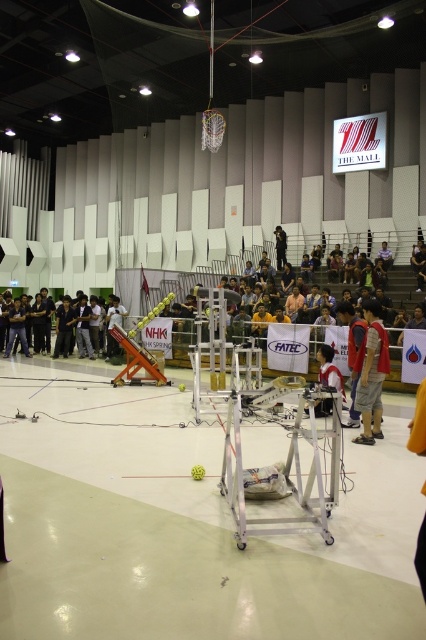
Question: Does dark gray shirt at center have a greater width compared to black matte person at center?

Choices:
 (A) no
 (B) yes

Answer: (B)

Question: Is dark gray shirt at center to the left of black matte person at center from the viewer's perspective?

Choices:
 (A) yes
 (B) no

Answer: (A)

Question: Which of these objects is positioned farthest from the red fabric shirt at right?

Choices:
 (A) dark gray shirt at center
 (B) black matte person at center

Answer: (B)

Question: Does red fabric shirt at right have a lesser width compared to dark gray shirt at center?

Choices:
 (A) no
 (B) yes

Answer: (B)

Question: Among these points, which one is nearest to the camera?

Choices:
 (A) (273, 234)
 (B) (377, 342)
 (C) (57, 314)

Answer: (B)

Question: Among these points, which one is nearest to the camera?

Choices:
 (A) [284, 234]
 (B) [66, 333]
 (C) [371, 433]

Answer: (C)